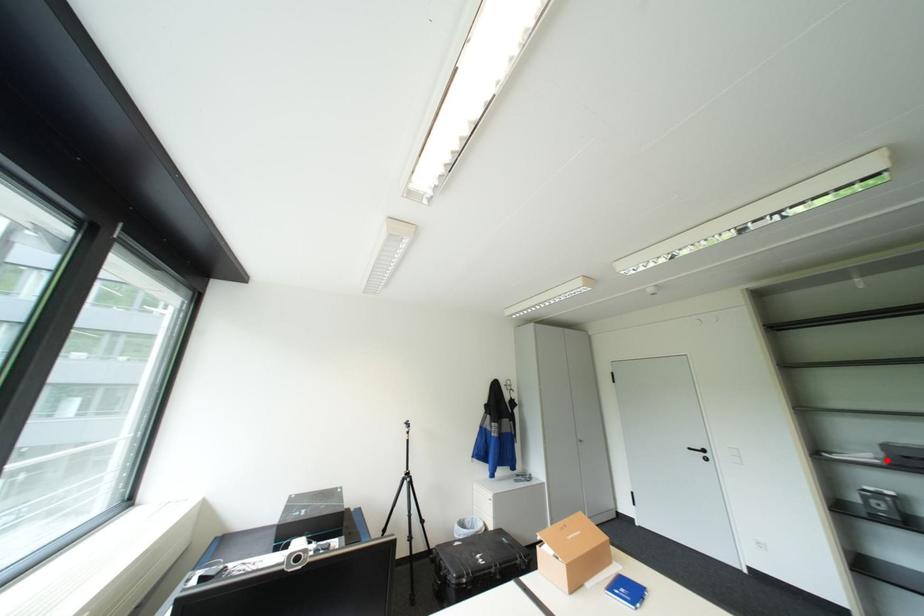
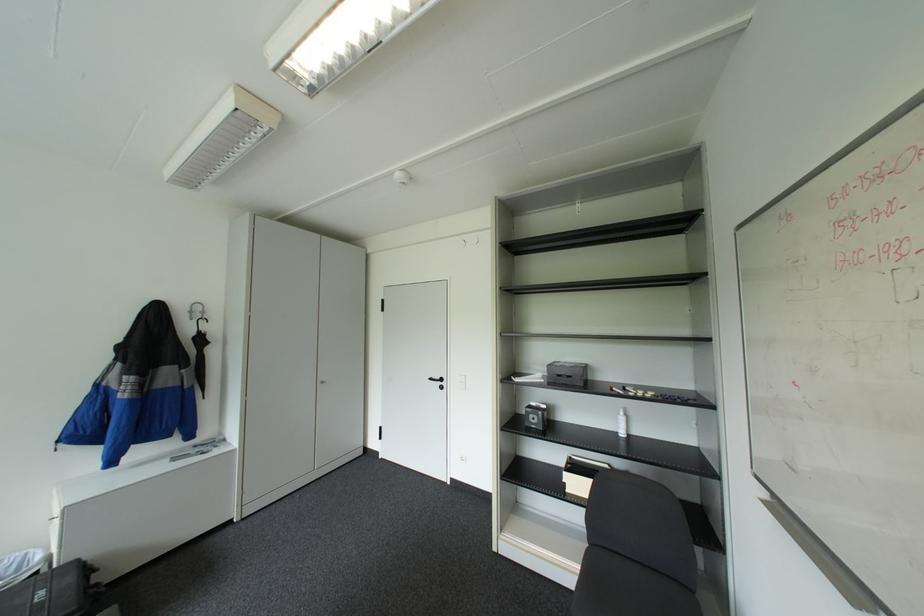
Find the pixel in the second image that matches the highlighted location in the first image.

(551, 379)